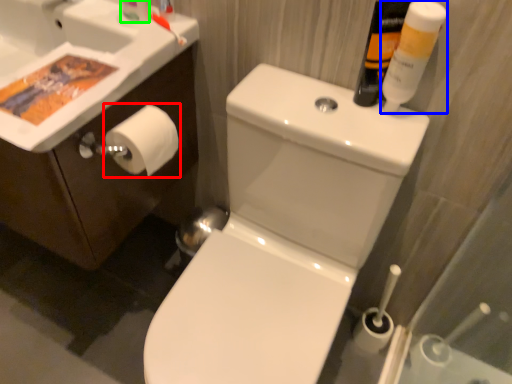
Question: Based on their relative distances, which object is nearer to toilet paper (highlighted by a red box)? Choose from mouthwash (highlighted by a blue box) and toiletry (highlighted by a green box).

Choices:
 (A) mouthwash
 (B) toiletry

Answer: (B)